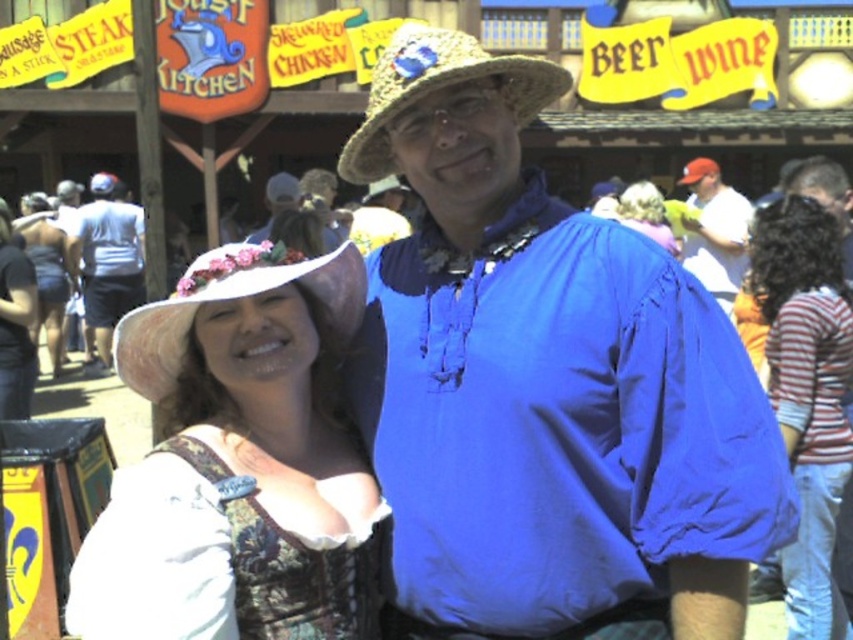
Who is shorter, printed fabric vest at center or red baseball cap at upper right?

red baseball cap at upper right

Is point (325, 580) positioned in front of point (689, 168)?

Yes, it is.

Who is more forward, (274,557) or (694,179)?

Point (274,557)

Identify the location of printed fabric vest at center. (299, 580).

Does white felt hat at center come behind matte white hat at lower left?

No, white felt hat at center is in front of matte white hat at lower left.

Does point (202, 412) come in front of point (65, 268)?

Yes, it is in front of point (65, 268).

Measure the distance between white felt hat at center and camera.

white felt hat at center and camera are 98.92 feet apart.

Find the location of a particular element. This screenshot has width=853, height=640. white felt hat at center is located at coordinates [x=238, y=461].

Which is above, striped cotton shirt at right or matte blue shirt at center?

matte blue shirt at center

Does point (831, 464) come behind point (270, 202)?

That is False.

This screenshot has width=853, height=640. Find the location of `striped cotton shirt at right`. striped cotton shirt at right is located at coordinates (807, 394).